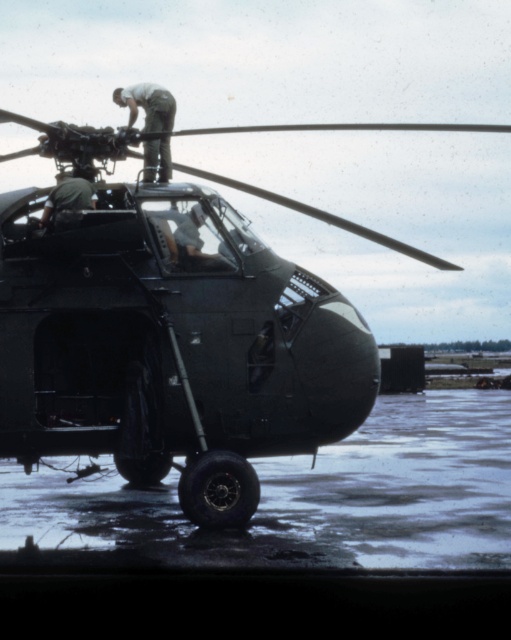
Is matte black helicopter at center further to camera compared to green matte uniform at center?

No, matte black helicopter at center is in front of green matte uniform at center.

Looking at this image, who is more distant from viewer, (228, 380) or (58, 216)?

Point (58, 216)

Identify the location of matte black helicopter at center. The height and width of the screenshot is (640, 511). (171, 330).

Between point (360, 129) and point (135, 113), which one is positioned in front?

Point (135, 113) is more forward.

Does matte black helicopter at center lie in front of green fabric man at upper center?

Yes, matte black helicopter at center is closer to the viewer.

Which is in front, point (95, 339) or point (115, 100)?

Point (95, 339) is more forward.

Image resolution: width=511 pixels, height=640 pixels. What are the coordinates of `matte black helicopter at center` in the screenshot? It's located at (171, 330).

Describe the element at coordinates (148, 106) in the screenshot. I see `green fabric man at upper center` at that location.

Is point (144, 97) behind point (74, 205)?

Yes, it is.

Is point (140, 93) less distant than point (80, 202)?

No.

At what (x,y) coordinates should I click in order to perform the action: click on green fabric man at upper center. Please return your answer as a coordinate pair (x, y). The width and height of the screenshot is (511, 640). Looking at the image, I should click on (148, 106).